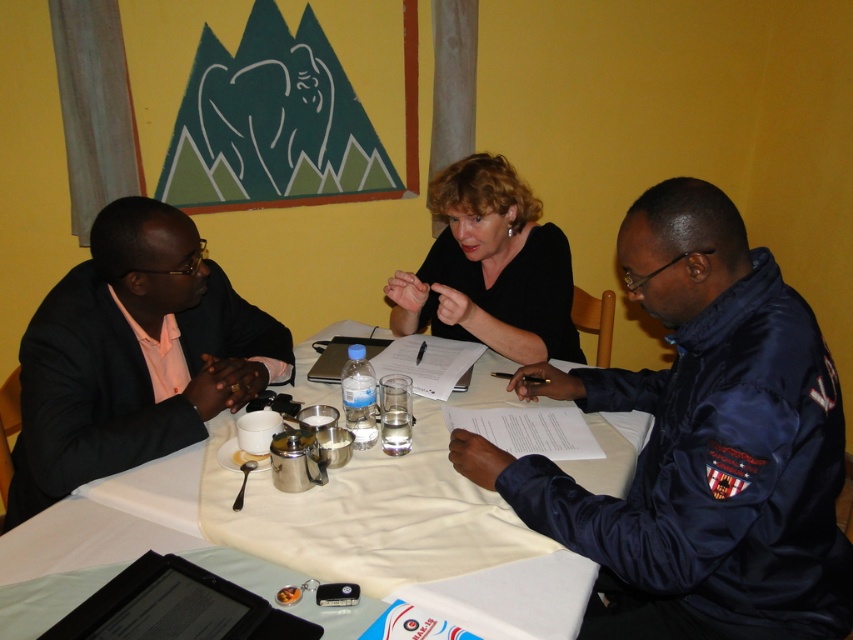
Does navy blue uniform at center appear over white cloth at center?

Yes.

Identify the location of navy blue uniform at center. The height and width of the screenshot is (640, 853). (700, 445).

Where is `navy blue uniform at center`? Image resolution: width=853 pixels, height=640 pixels. navy blue uniform at center is located at coordinates (700, 445).

Locate an element on the screen. black satin suit at left is located at coordinates (132, 355).

The height and width of the screenshot is (640, 853). Find the location of `black satin suit at left`. black satin suit at left is located at coordinates (132, 355).

Which of these two, navy blue uniform at center or black satin suit at left, stands shorter?

black satin suit at left is shorter.

Does navy blue uniform at center appear on the right side of black satin suit at left?

Correct, you'll find navy blue uniform at center to the right of black satin suit at left.

Which is behind, point (502, 477) or point (62, 374)?

The point (62, 374) is behind.

Find the location of a particular element. navy blue uniform at center is located at coordinates (700, 445).